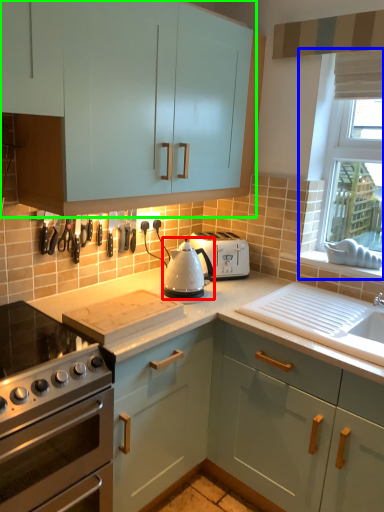
Question: Which object is the farthest from kitchen appliance (highlighted by a red box)? Choose among these: window (highlighted by a blue box) or cabinetry (highlighted by a green box).

Choices:
 (A) window
 (B) cabinetry

Answer: (A)